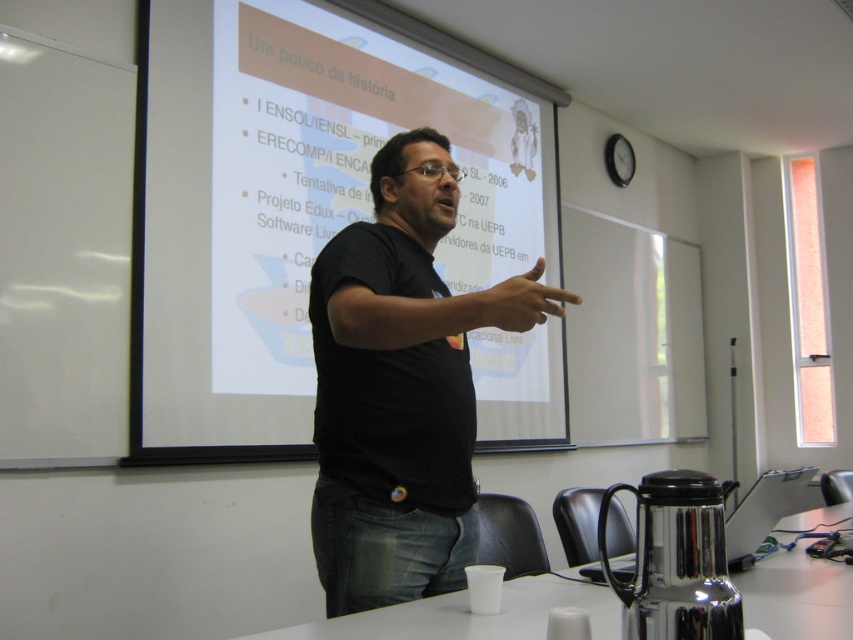
Question: Which point is farther to the camera?

Choices:
 (A) (550, 292)
 (B) (328, 292)
 (C) (518, 406)

Answer: (C)

Question: Considering the real-world distances, which object is closest to the white matte projection screen at upper center?

Choices:
 (A) matte black finger at center
 (B) black matte shirt at center

Answer: (B)

Question: Is black matte shirt at center below matte black finger at center?

Choices:
 (A) no
 (B) yes

Answer: (B)

Question: Does white matte projection screen at upper center appear on the left side of black matte shirt at center?

Choices:
 (A) yes
 (B) no

Answer: (A)

Question: Which of these objects is positioned closest to the black matte shirt at center?

Choices:
 (A) matte black finger at center
 (B) white matte projection screen at upper center

Answer: (A)

Question: Can you confirm if white matte projection screen at upper center is positioned above matte black finger at center?

Choices:
 (A) no
 (B) yes

Answer: (B)